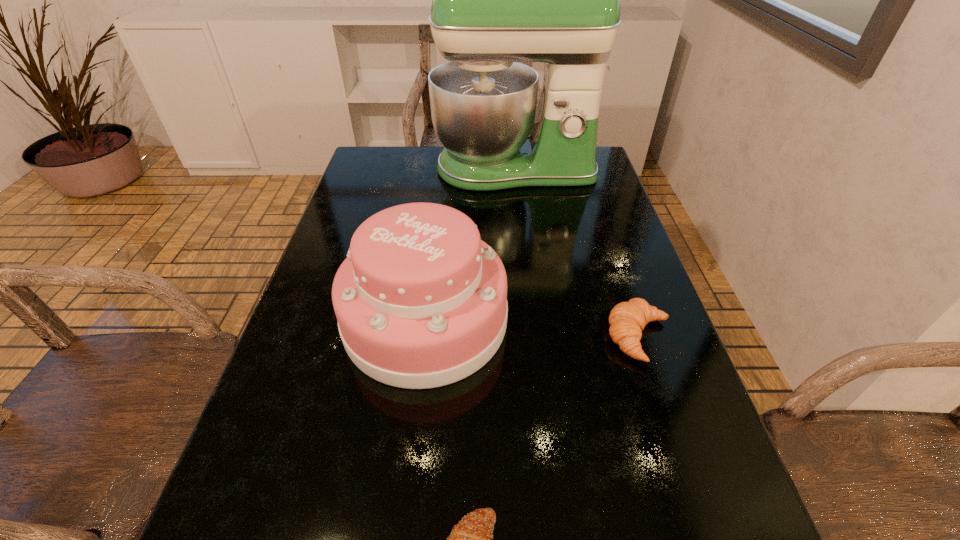
The width and height of the screenshot is (960, 540). In order to click on mixer that is at the right edge in this screenshot , I will do `click(497, 0)`.

Identify the location of crescent roll located at the right edge. Image resolution: width=960 pixels, height=540 pixels. (627, 320).

Where is `object that is positioned at the far right corner`? object that is positioned at the far right corner is located at coordinates point(497,0).

Locate an element on the screen. This screenshot has height=540, width=960. vacant region at the left edge of the desktop is located at coordinates (309, 394).

Where is `free space at the right edge of the desktop`? Image resolution: width=960 pixels, height=540 pixels. free space at the right edge of the desktop is located at coordinates (632, 418).

Identify the location of vacant region between the third shortest object and the second shortest object. The image size is (960, 540). (533, 328).

I want to click on free area in between the mixer and the taller crescent roll, so click(577, 253).

Select which object is the third closest to the tallest object. Please provide its 2D coordinates. Your answer should be formatted as a tuple, i.e. [(x, y)], where the tuple contains the x and y coordinates of a point satisfying the conditions above.

[(471, 539)]

Choose which object is the second nearest neighbor to the second tallest object. Please provide its 2D coordinates. Your answer should be formatted as a tuple, i.e. [(x, y)], where the tuple contains the x and y coordinates of a point satisfying the conditions above.

[(471, 539)]

Identify which crescent roll is the second closest to the tallest object. Please provide its 2D coordinates. Your answer should be formatted as a tuple, i.e. [(x, y)], where the tuple contains the x and y coordinates of a point satisfying the conditions above.

[(471, 539)]